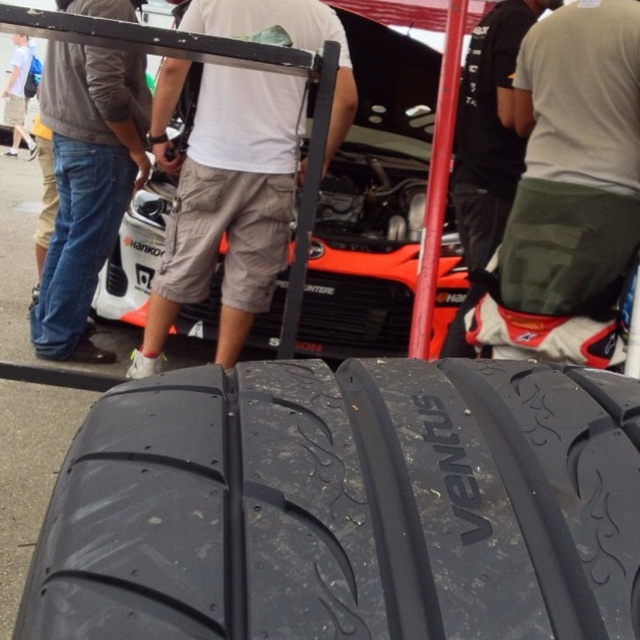
You are a photographer at the event and need to capture a clear shot of the tire and the engine. You notice two people wearing green camo shorts at center and dark gray shorts at center. Which person is shorter?

The green camo shorts at center has a lesser height compared to dark gray shorts at center, so the person wearing green camo shorts at center is shorter.